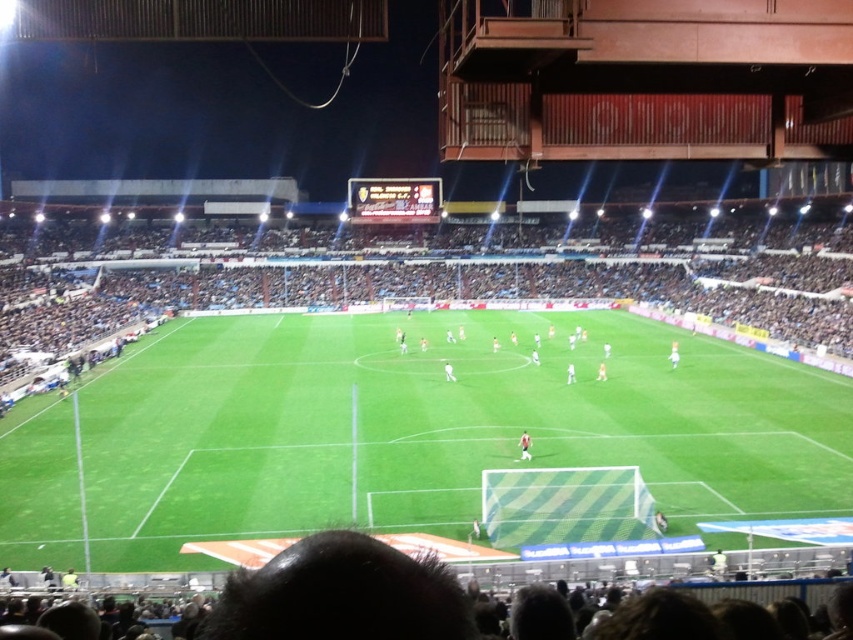
Does green grass football field at center have a greater height compared to blue fabric crowd at left?

Incorrect, green grass football field at center's height is not larger of blue fabric crowd at left's.

Measure the distance from green grass football field at center to blue fabric crowd at left.

A distance of 84.38 feet exists between green grass football field at center and blue fabric crowd at left.

Who is more distant from viewer, (421, 502) or (583, 266)?

The point (583, 266) is more distant.

Locate an element on the screen. This screenshot has height=640, width=853. green grass football field at center is located at coordinates (407, 435).